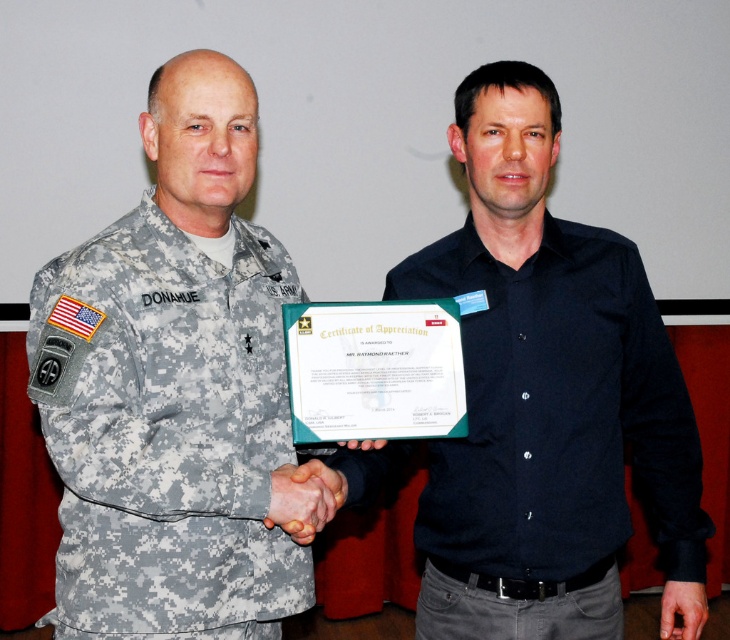
Is camouflage fabric uniform at left bigger than black matte shirt at center?

Yes, camouflage fabric uniform at left is bigger than black matte shirt at center.

Who is positioned more to the right, camouflage fabric uniform at left or black matte shirt at center?

From the viewer's perspective, black matte shirt at center appears more on the right side.

Is point (257, 560) farther from camera compared to point (688, 512)?

No, (257, 560) is closer to viewer.

Where is `camouflage fabric uniform at left`? The width and height of the screenshot is (730, 640). camouflage fabric uniform at left is located at coordinates (166, 429).